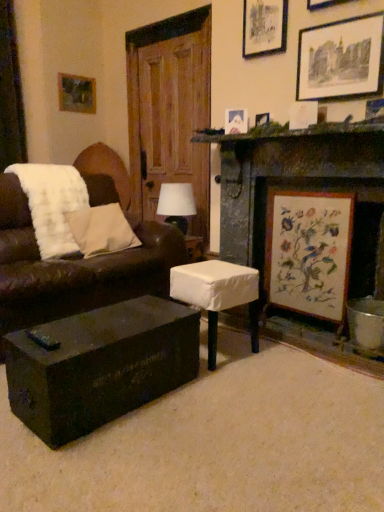
In order to face embroidered fabric picture at right, the 2th picture frame from the right, should I rotate leftwards or rightwards?

You should rotate right by 14.756 degrees.

Locate an element on the screen. Image resolution: width=384 pixels, height=512 pixels. white fabric lampshade at center is located at coordinates (176, 204).

Find the location of `wooden picture frame at upper left, which ranks as the first picture frame in left-to-right order`. wooden picture frame at upper left, which ranks as the first picture frame in left-to-right order is located at coordinates (76, 94).

The image size is (384, 512). Describe the element at coordinates (76, 94) in the screenshot. I see `wooden picture frame at upper left, which ranks as the first picture frame in left-to-right order` at that location.

What is the approximate height of brown leather couch at left?

The height of brown leather couch at left is 37.54 inches.

Image resolution: width=384 pixels, height=512 pixels. What do you see at coordinates (99, 365) in the screenshot?
I see `matte black trunk at lower center` at bounding box center [99, 365].

The height and width of the screenshot is (512, 384). Describe the element at coordinates (303, 114) in the screenshot. I see `matte white picture frame at upper right, which ranks as the 4th picture frame in left-to-right order` at that location.

You are a GUI agent. You are given a task and a screenshot of the screen. Output one action in this format:
    pyautogui.click(x=<x>, y=<y>)
    Task: Click on the embroidered fabric picture at right, the 2th picture frame from the right
    
    Given the screenshot: What is the action you would take?
    coord(309,252)

Is green mossy stone mantle at upper right oriented towards wooden fireplace at right?

No, green mossy stone mantle at upper right is not oriented towards wooden fireplace at right.

Does green mossy stone mantle at upper right have a greater height compared to wooden fireplace at right?

In fact, green mossy stone mantle at upper right may be shorter than wooden fireplace at right.

Is green mossy stone mantle at upper right thinner than wooden fireplace at right?

Correct, the width of green mossy stone mantle at upper right is less than that of wooden fireplace at right.

Is brown leather couch at left touching matte white picture frame at upper right, the 2th picture frame positioned from the bottom?

No, brown leather couch at left is not beside matte white picture frame at upper right, the 2th picture frame positioned from the bottom.

Can you confirm if brown leather couch at left is smaller than matte white picture frame at upper right, which appears as the third picture frame when viewed from the front?

No.

Looking at this image, is brown leather couch at left positioned in front of matte white picture frame at upper right, which is counted as the 5th picture frame, starting from the top?

Yes, it is.

From the image's perspective, who appears lower, brown leather couch at left or matte white picture frame at upper right, which is counted as the 5th picture frame, starting from the top?

brown leather couch at left appears lower in the image.

How distant is white fabric lampshade at center from brown leather couch at left?

white fabric lampshade at center and brown leather couch at left are 31.19 inches apart.

Looking at this image, from a real-world perspective, is white fabric lampshade at center physically located above or below brown leather couch at left?

In terms of real-world spatial position, white fabric lampshade at center is above brown leather couch at left.

From the image's perspective, is white fabric lampshade at center located above brown leather couch at left?

Yes.

Can you tell me how much white fabric lampshade at center and brown leather couch at left differ in facing direction?

white fabric lampshade at center and brown leather couch at left are facing 9.86 degrees away from each other.

Can you confirm if white fabric-covered stool at center is positioned to the right of matte white picture frame at upper right, which ranks as the 4th picture frame in back-to-front order?

No, white fabric-covered stool at center is not to the right of matte white picture frame at upper right, which ranks as the 4th picture frame in back-to-front order.

In terms of height, does white fabric-covered stool at center look taller or shorter compared to matte white picture frame at upper right, which ranks as the 4th picture frame in back-to-front order?

In the image, white fabric-covered stool at center appears to be taller than matte white picture frame at upper right, which ranks as the 4th picture frame in back-to-front order.

Is the surface of white fabric-covered stool at center in direct contact with matte white picture frame at upper right, which ranks as the third picture frame in right-to-left order?

white fabric-covered stool at center and matte white picture frame at upper right, which ranks as the third picture frame in right-to-left order, are clearly separated.

Between green mossy stone mantle at upper right and matte white picture frame at upper center, placed as the fifth picture frame when sorted from right to left, which one is positioned behind?

matte white picture frame at upper center, placed as the fifth picture frame when sorted from right to left, is behind.

From the image's perspective, count 2nd picture frames upward from the green mossy stone mantle at upper right and point to it. Please provide its 2D coordinates.

[(236, 121)]

From a real-world perspective, is green mossy stone mantle at upper right below matte white picture frame at upper center, which is counted as the second picture frame, starting from the left?

Indeed, from a real-world perspective, green mossy stone mantle at upper right is positioned beneath matte white picture frame at upper center, which is counted as the second picture frame, starting from the left.

Consider the image. Can we say green mossy stone mantle at upper right lies outside matte white picture frame at upper center, the 3th picture frame positioned from the bottom?

green mossy stone mantle at upper right lies outside matte white picture frame at upper center, the 3th picture frame positioned from the bottom,'s area.

Which of these two, matte black trunk at lower center or wooden picture frame at upper left, which ranks as the sixth picture frame in bottom-to-top order, stands shorter?

Standing shorter between the two is matte black trunk at lower center.

Is matte black trunk at lower center positioned with its back to wooden picture frame at upper left, which ranks as the first picture frame in left-to-right order?

No, matte black trunk at lower center's orientation is not away from wooden picture frame at upper left, which ranks as the first picture frame in left-to-right order.

Can you confirm if matte black trunk at lower center is thinner than wooden picture frame at upper left, the sixth picture frame viewed from the right?

In fact, matte black trunk at lower center might be wider than wooden picture frame at upper left, the sixth picture frame viewed from the right.

At what (x,y) coordinates should I click in order to perform the action: click on the 6th picture frame behind the matte black trunk at lower center. Please return your answer as a coordinate pair (x, y). This screenshot has height=512, width=384. Looking at the image, I should click on (76, 94).

Considering the sizes of objects wooden picture frame at upper left, acting as the 1th picture frame starting from the top, and matte paper picture frame at upper right, the 4th picture frame from the bottom, in the image provided, who is taller, wooden picture frame at upper left, acting as the 1th picture frame starting from the top, or matte paper picture frame at upper right, the 4th picture frame from the bottom,?

matte paper picture frame at upper right, the 4th picture frame from the bottom.

Could you tell me if wooden picture frame at upper left, which ranks as the sixth picture frame in bottom-to-top order, is turned towards matte paper picture frame at upper right, which ranks as the first picture frame in right-to-left order?

Yes, wooden picture frame at upper left, which ranks as the sixth picture frame in bottom-to-top order, is oriented towards matte paper picture frame at upper right, which ranks as the first picture frame in right-to-left order.

Locate an element on the screen. The height and width of the screenshot is (512, 384). mantle behind the wooden fireplace at right is located at coordinates (289, 131).

At what (x,y) coordinates should I click in order to perform the action: click on studio couch in front of the matte white picture frame at upper right, which ranks as the third picture frame in right-to-left order. Please return your answer as a coordinate pair (x, y). This screenshot has height=512, width=384. Looking at the image, I should click on (73, 269).

Estimate the real-world distances between objects in this image. Which object is further from embroidered fabric picture at right, placed as the sixth picture frame when sorted from top to bottom, white fabric-covered stool at center or matte white picture frame at upper center, the 3th picture frame positioned from the bottom?

Among the two, matte white picture frame at upper center, the 3th picture frame positioned from the bottom, is located further to embroidered fabric picture at right, placed as the sixth picture frame when sorted from top to bottom.

Which object lies nearer to the anchor point white fabric-covered stool at center, embroidered fabric picture at right, placed as the fifth picture frame when sorted from left to right, or green mossy stone mantle at upper right?

embroidered fabric picture at right, placed as the fifth picture frame when sorted from left to right.

From the image, which object appears to be nearer to white fluffy pillow at left, embroidered fabric picture at right, the 2th picture frame from the right, or matte paper picture frame at upper right, which is counted as the 3th picture frame, starting from the top?

embroidered fabric picture at right, the 2th picture frame from the right, is positioned closer to the anchor white fluffy pillow at left.

Based on their spatial positions, is matte black picture frame at upper center, the fifth picture frame from the bottom, or embroidered fabric picture at right, the 2th picture frame from the right, closer to wooden fireplace at right?

embroidered fabric picture at right, the 2th picture frame from the right, lies closer to wooden fireplace at right than the other object.

From the picture: When comparing their distances from green mossy stone mantle at upper right, does brown leather couch at left or matte black trunk at lower center seem further?

matte black trunk at lower center is positioned further to the anchor green mossy stone mantle at upper right.

Which object lies nearer to the anchor point matte black trunk at lower center, white fabric lampshade at center or matte white picture frame at upper right, the 2th picture frame positioned from the bottom?

The object closer to matte black trunk at lower center is white fabric lampshade at center.

Looking at the image, which one is located further to green mossy stone mantle at upper right, white fabric lampshade at center or matte black trunk at lower center?

Among the two, matte black trunk at lower center is located further to green mossy stone mantle at upper right.

Which object lies further to the anchor point matte white picture frame at upper center, placed as the fifth picture frame when sorted from right to left, matte black trunk at lower center or embroidered fabric picture at right, placed as the fifth picture frame when sorted from left to right?

matte black trunk at lower center is positioned further to the anchor matte white picture frame at upper center, placed as the fifth picture frame when sorted from right to left.

Locate an element on the screen. lamp between matte paper picture frame at upper right, the 6th picture frame positioned from the back, and embroidered fabric picture at right, the 2th picture frame from the right, in the up-down direction is located at coordinates (176, 204).

Find the location of `mantle between white fabric-covered stool at center and white fabric lampshade at center along the z-axis`. mantle between white fabric-covered stool at center and white fabric lampshade at center along the z-axis is located at coordinates (289, 131).

The width and height of the screenshot is (384, 512). Identify the location of picture frame between wooden picture frame at upper left, which ranks as the first picture frame in left-to-right order, and matte black picture frame at upper center, the fifth picture frame from the bottom, from left to right. (236, 121).

Find the location of a particular element. The height and width of the screenshot is (512, 384). lamp between matte white picture frame at upper center, which is counted as the second picture frame, starting from the left, and embroidered fabric picture at right, placed as the sixth picture frame when sorted from top to bottom, vertically is located at coordinates 176,204.